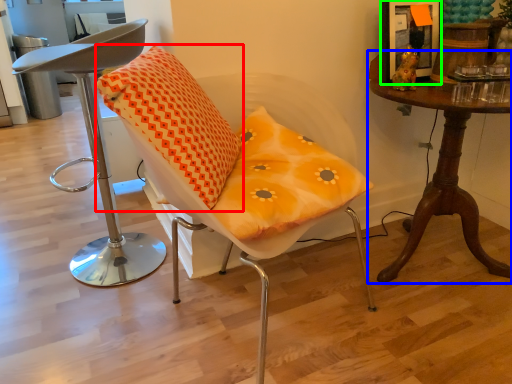
Question: Considering the real-world distances, which object is farthest from pillow (highlighted by a red box)? table (highlighted by a blue box) or picture frame (highlighted by a green box)?

Choices:
 (A) table
 (B) picture frame

Answer: (B)